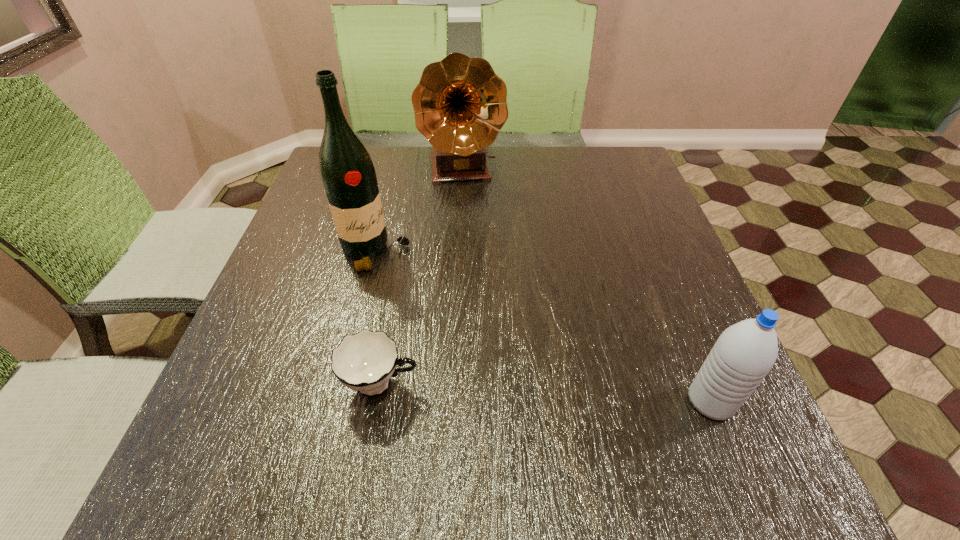
Locate an element on the screen. free space that satisfies the following two spatial constraints: 1. on the front side of the cup; 2. on the side of the third nearest object with the handle is located at coordinates pyautogui.click(x=343, y=384).